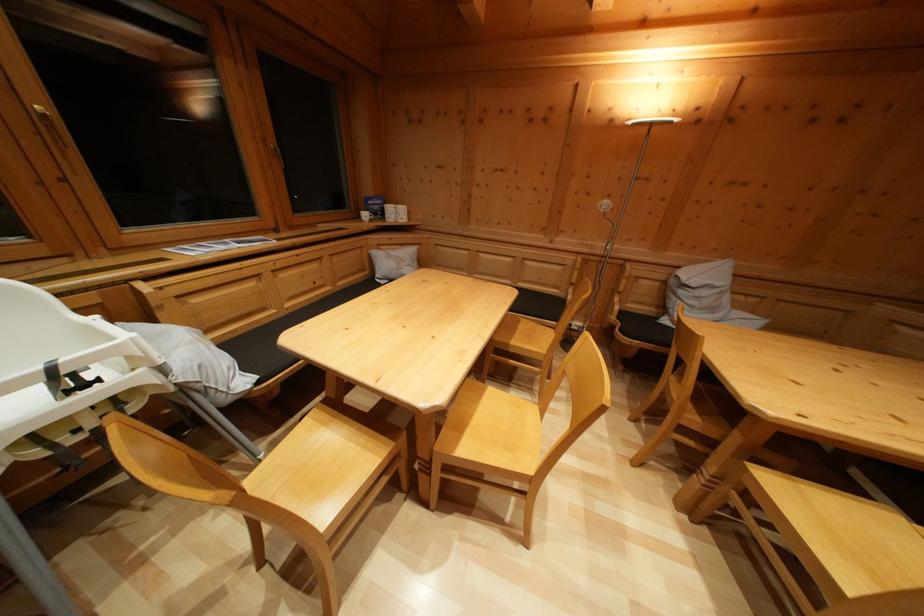
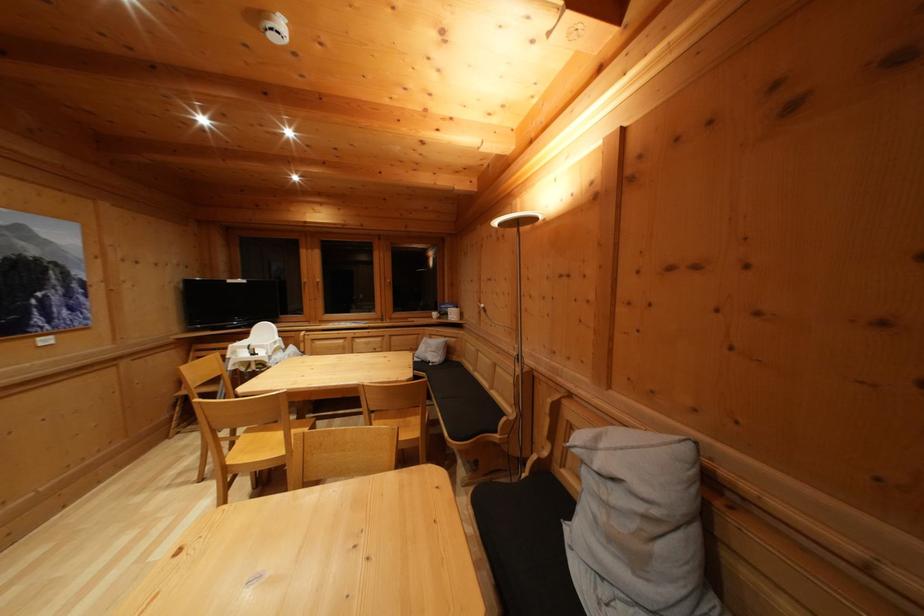
Find the pixel in the second image that matches (719,315) in the first image.

(640, 565)